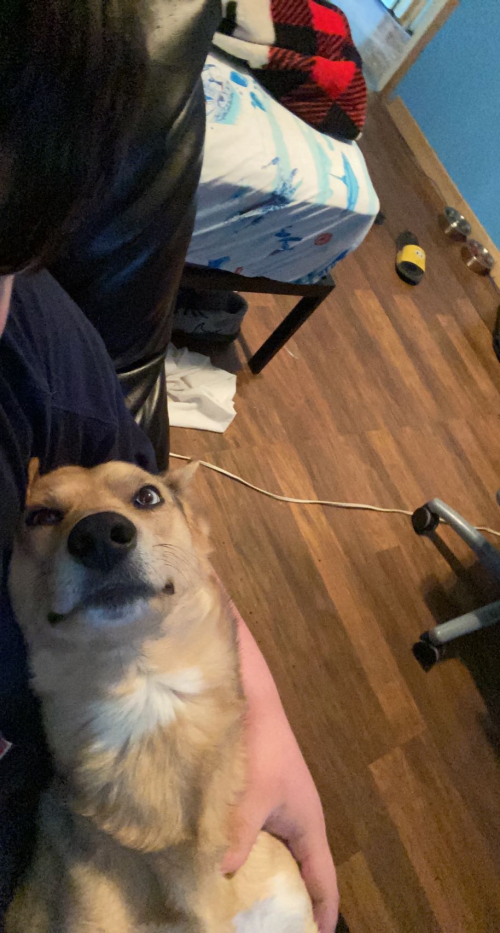
Identify the location of blue wall. This screenshot has width=500, height=933. (447, 57).